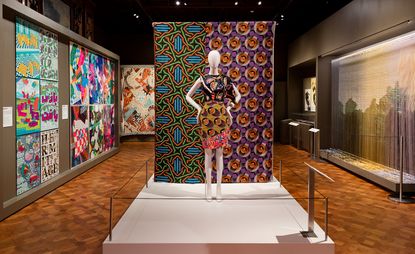
The height and width of the screenshot is (254, 415). In order to click on manikin in this screenshot , I will do `click(219, 163)`.